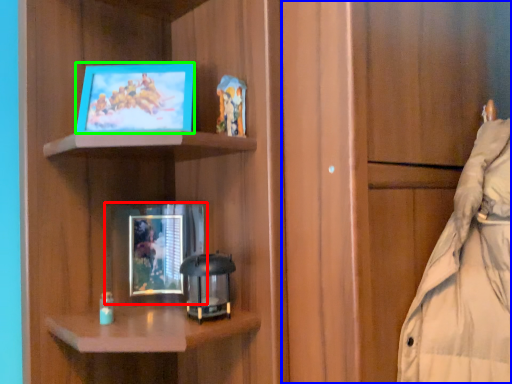
Question: Considering the real-world distances, which object is farthest from picture frame (highlighted by a red box)? cabinetry (highlighted by a blue box) or picture frame (highlighted by a green box)?

Choices:
 (A) cabinetry
 (B) picture frame

Answer: (A)